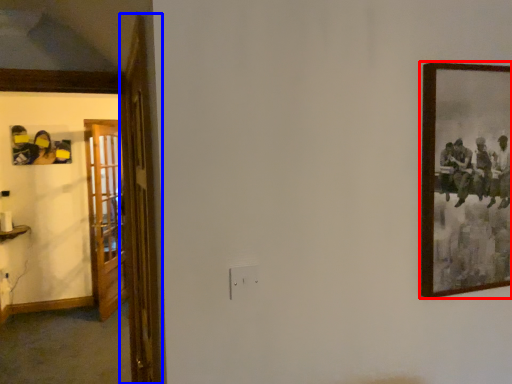
Question: Which point is closer to the camera, picture frame (highlighted by a red box) or door (highlighted by a blue box)?

Choices:
 (A) picture frame
 (B) door

Answer: (B)